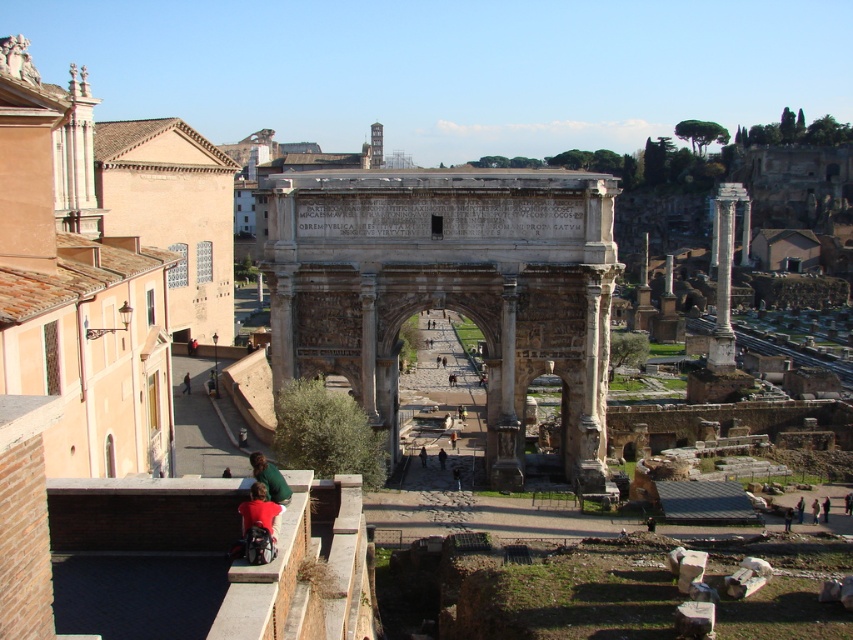
You are standing at the Roman Forum and want to take a photo of the point at coordinates (811, 506). Your camera has a maximum focus range of 70 meters. Will the camera be able to focus on the point?

The point at coordinates (811, 506) is 69.50 meters away from the camera, which is within the maximum focus range of 70 meters. Therefore, the camera can focus on the point.